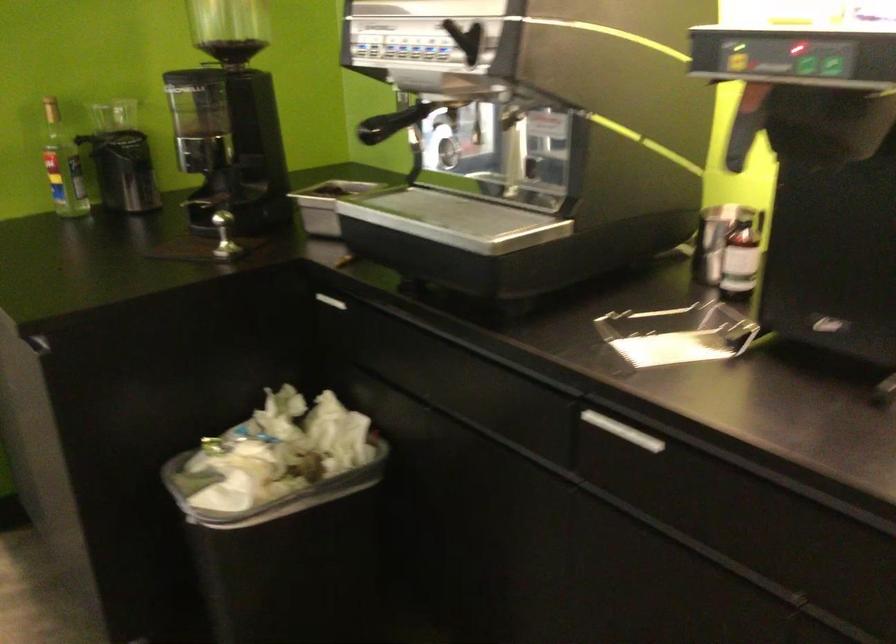
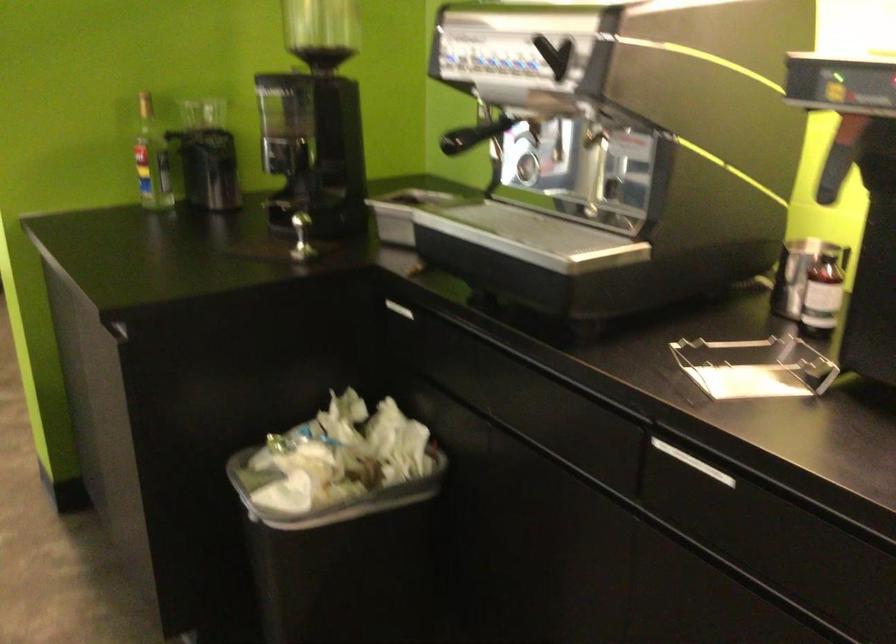
Where in the second image is the point corresponding to [270,491] from the first image?

(328, 495)